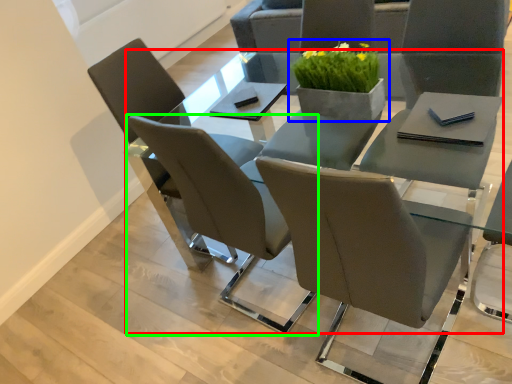
Question: Considering the real-world distances, which object is closest to round table (highlighted by a red box)? houseplant (highlighted by a blue box) or chair (highlighted by a green box).

Choices:
 (A) houseplant
 (B) chair

Answer: (A)